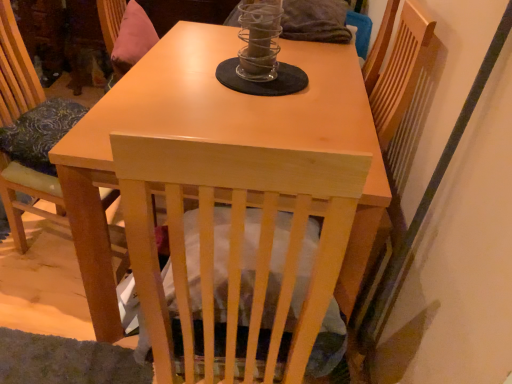
The width and height of the screenshot is (512, 384). What are the coordinates of `light wood chair at left` in the screenshot? It's located at (15, 71).

Image resolution: width=512 pixels, height=384 pixels. What do you see at coordinates (217, 140) in the screenshot? I see `light wood table at center` at bounding box center [217, 140].

This screenshot has height=384, width=512. What do you see at coordinates (259, 39) in the screenshot?
I see `clear glass candle holder at center` at bounding box center [259, 39].

Identify the location of light wood chair at left. The image size is (512, 384). (15, 71).

Between light wood table at center and light wood chair at left, which one appears on the right side from the viewer's perspective?

light wood table at center.

Is light wood table at center directly adjacent to light wood chair at left?

No, light wood table at center is not touching light wood chair at left.

Does light wood table at center contain light wood chair at left?

Actually, light wood chair at left is outside light wood table at center.

At what (x,y) coordinates should I click in order to perform the action: click on table positioned vertically above the light wood chair at left (from a real-world perspective). Please return your answer as a coordinate pair (x, y). The height and width of the screenshot is (384, 512). Looking at the image, I should click on (217, 140).

Does point (169, 49) come closer to viewer compared to point (272, 16)?

That is False.

Considering the relative positions of light wood table at center and clear glass candle holder at center in the image provided, is light wood table at center to the right of clear glass candle holder at center from the viewer's perspective?

No.

Is light wood table at center thinner than clear glass candle holder at center?

No, light wood table at center is not thinner than clear glass candle holder at center.

Relative to clear glass candle holder at center, is light wood table at center in front or behind?

light wood table at center is positioned closer to the viewer than clear glass candle holder at center.

Considering the positions of point (263, 26) and point (197, 29), is point (263, 26) closer or farther from the camera than point (197, 29)?

Point (263, 26).

Can light wood table at center be found inside clear glass candle holder at center?

Definitely not — light wood table at center is not inside clear glass candle holder at center.

Considering the relative positions of clear glass candle holder at center and light wood table at center in the image provided, is clear glass candle holder at center to the left of light wood table at center from the viewer's perspective?

No, clear glass candle holder at center is not to the left of light wood table at center.

Considering the relative sizes of clear glass candle holder at center and light wood table at center in the image provided, is clear glass candle holder at center bigger than light wood table at center?

Incorrect, clear glass candle holder at center is not larger than light wood table at center.

Is light wood chair at left positioned with its back to clear glass candle holder at center?

No, light wood chair at left's orientation is not away from clear glass candle holder at center.

Which is in front, point (13, 98) or point (271, 75)?

The point (271, 75) is closer to the camera.

From their relative heights in the image, would you say light wood chair at left is taller or shorter than clear glass candle holder at center?

Clearly, light wood chair at left is taller compared to clear glass candle holder at center.

Which object is positioned more to the right, clear glass candle holder at center or light wood chair at left?

clear glass candle holder at center.

From the picture: From the image's perspective, does clear glass candle holder at center appear lower than light wood chair at left?

No, from the image's perspective, clear glass candle holder at center is not beneath light wood chair at left.

From a real-world perspective, between clear glass candle holder at center and light wood chair at left, who is vertically lower?

From a 3D spatial view, light wood chair at left is below.

Could you tell me if clear glass candle holder at center is facing light wood chair at left?

Yes, clear glass candle holder at center is turned towards light wood chair at left.

Between light wood chair at left and light wood table at center, which one appears on the right side from the viewer's perspective?

light wood table at center is more to the right.

Which of these two, light wood chair at left or light wood table at center, is wider?

light wood table at center.

Does light wood chair at left touch light wood table at center?

No, light wood chair at left is not in contact with light wood table at center.

Does light wood chair at left lie behind light wood table at center?

That is True.

The width and height of the screenshot is (512, 384). Find the location of `table lying in front of the light wood chair at left`. table lying in front of the light wood chair at left is located at coordinates (217, 140).

Where is `candle holder above the light wood table at center (from a real-world perspective)`? The height and width of the screenshot is (384, 512). candle holder above the light wood table at center (from a real-world perspective) is located at coordinates coord(259,39).

Looking at the image, which one is located closer to clear glass candle holder at center, light wood chair at left or light wood table at center?

Answer: The object closer to clear glass candle holder at center is light wood table at center.

When comparing their distances from light wood chair at left, does clear glass candle holder at center or light wood table at center seem further?

clear glass candle holder at center lies further to light wood chair at left than the other object.

Which object lies nearer to the anchor point clear glass candle holder at center, light wood table at center or light wood chair at left?

The object closer to clear glass candle holder at center is light wood table at center.

Which object lies nearer to the anchor point light wood table at center, light wood chair at left or clear glass candle holder at center?

clear glass candle holder at center is closer to light wood table at center.

Based on their spatial positions, is clear glass candle holder at center or light wood chair at left further from light wood table at center?

Among the two, light wood chair at left is located further to light wood table at center.

From the image, which object appears to be nearer to light wood chair at left, light wood table at center or clear glass candle holder at center?

Among the two, light wood table at center is located nearer to light wood chair at left.

You are a GUI agent. You are given a task and a screenshot of the screen. Output one action in this format:
    pyautogui.click(x=<x>, y=<y>)
    Task: Click on the chair between light wood table at center and clear glass candle holder at center from front to back
    This screenshot has width=512, height=384.
    Given the screenshot: What is the action you would take?
    pyautogui.click(x=15, y=71)